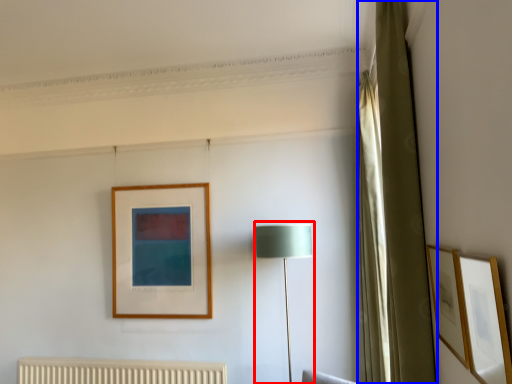
Question: Which object appears farthest to the camera in this image, table lamp (highlighted by a red box) or curtain (highlighted by a blue box)?

Choices:
 (A) table lamp
 (B) curtain

Answer: (A)